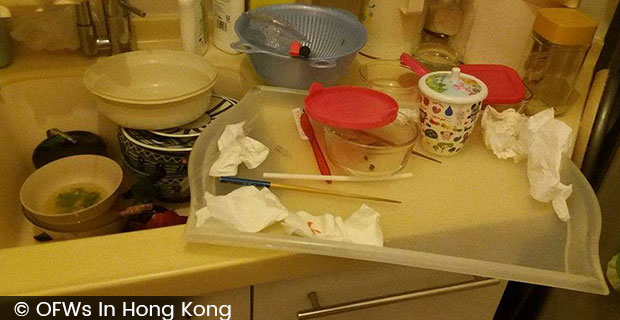
Identify the location of sink. (20, 122).